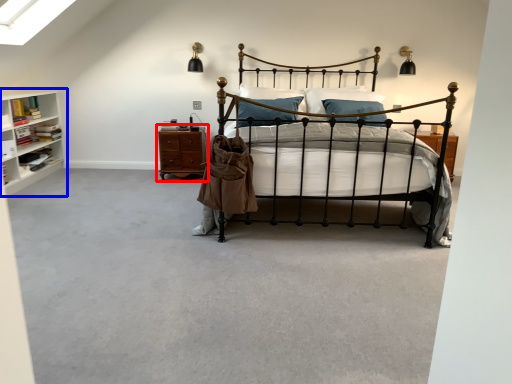
Question: Which point is further to the camera, nightstand (highlighted by a red box) or shelf (highlighted by a blue box)?

Choices:
 (A) nightstand
 (B) shelf

Answer: (A)